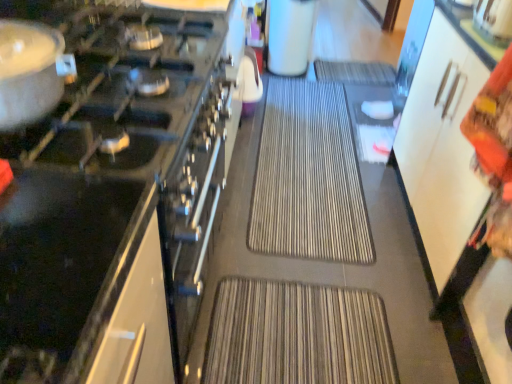
Image resolution: width=512 pixels, height=384 pixels. What do you see at coordinates (289, 35) in the screenshot?
I see `white matte coffee maker at upper center, the second appliance positioned from the left` at bounding box center [289, 35].

The width and height of the screenshot is (512, 384). What are the coordinates of `brown textured mat at center` in the screenshot? It's located at (308, 178).

Find the location of `white matte coffee maker at upper center, the second appliance positioned from the left`. white matte coffee maker at upper center, the second appliance positioned from the left is located at coordinates (289, 35).

Identify the location of the 1st appliance below the white matte coffee maker at upper center, the second appliance positioned from the left (from the image's perspective). The width and height of the screenshot is (512, 384). (494, 21).

Is metallic silver kettle at upper right, which appears as the third appliance when viewed from the left, not within white matte coffee maker at upper center, the third appliance in the front-to-back sequence?

metallic silver kettle at upper right, which appears as the third appliance when viewed from the left, lies outside white matte coffee maker at upper center, the third appliance in the front-to-back sequence,'s area.

From a real-world perspective, is metallic silver kettle at upper right, the second appliance from the back, under white matte coffee maker at upper center, acting as the first appliance starting from the back?

No, from a real-world perspective, metallic silver kettle at upper right, the second appliance from the back, is not under white matte coffee maker at upper center, acting as the first appliance starting from the back.

Is metallic silver kettle at upper right, which appears as the third appliance when viewed from the left, far away from white matte coffee maker at upper center, the third appliance ordered from the bottom?

Indeed, metallic silver kettle at upper right, which appears as the third appliance when viewed from the left, is not near white matte coffee maker at upper center, the third appliance ordered from the bottom.

Can white matte coffee maker at upper center, which appears as the 2th appliance when viewed from the right, be found inside black glass cooktop at left, arranged as the first appliance when ordered from the bottom?

No, white matte coffee maker at upper center, which appears as the 2th appliance when viewed from the right, is not a part of black glass cooktop at left, arranged as the first appliance when ordered from the bottom.

In the scene shown: Considering the relative positions of black glass cooktop at left, marked as the 1th appliance in a front-to-back arrangement, and white matte coffee maker at upper center, which is the first appliance from top to bottom, in the image provided, is black glass cooktop at left, marked as the 1th appliance in a front-to-back arrangement, to the left of white matte coffee maker at upper center, which is the first appliance from top to bottom, from the viewer's perspective?

Yes.

Is black glass cooktop at left, marked as the 1th appliance in a front-to-back arrangement, turned away from white matte coffee maker at upper center, the third appliance ordered from the bottom?

No.

Considering the positions of points (503, 24) and (280, 118), is point (503, 24) closer to camera compared to point (280, 118)?

Yes.

Looking at this image, from the image's perspective, does metallic silver kettle at upper right, which ranks as the 2th appliance in front-to-back order, appear lower than brown textured mat at center?

No.

How many degrees apart are the facing directions of metallic silver kettle at upper right, which appears as the third appliance when viewed from the left, and brown textured mat at center?

The facing directions of metallic silver kettle at upper right, which appears as the third appliance when viewed from the left, and brown textured mat at center are 89.7 degrees apart.

Is metallic silver kettle at upper right, which appears as the third appliance when viewed from the left, bigger than brown textured mat at center?

No.

Which is more distant, [35,25] or [142,27]?

Positioned behind is point [142,27].

Locate an element on the screen. This screenshot has width=512, height=384. appliance below the matte silver pot at left (from the image's perspective) is located at coordinates (118, 198).

From the image's perspective, does matte silver pot at left appear lower than black glass cooktop at left, acting as the 3th appliance starting from the top?

No, from the image's perspective, matte silver pot at left is not beneath black glass cooktop at left, acting as the 3th appliance starting from the top.

From a real-world perspective, which object rests below the other?

black glass cooktop at left, the 1th appliance viewed from the left.

Does white matte coffee maker at upper center, which is the first appliance from top to bottom, have a larger size compared to black glass cooktop at left, the 1th appliance viewed from the left?

Incorrect, white matte coffee maker at upper center, which is the first appliance from top to bottom, is not larger than black glass cooktop at left, the 1th appliance viewed from the left.

Is white matte coffee maker at upper center, which is the first appliance from top to bottom, further to the viewer compared to black glass cooktop at left, acting as the 3th appliance starting from the top?

Yes, white matte coffee maker at upper center, which is the first appliance from top to bottom, is further from the viewer.

Can you tell me how much white matte coffee maker at upper center, the second appliance positioned from the left, and black glass cooktop at left, the 3th appliance in the back-to-front sequence, differ in facing direction?

white matte coffee maker at upper center, the second appliance positioned from the left, and black glass cooktop at left, the 3th appliance in the back-to-front sequence, are facing 89.8 degrees away from each other.

Considering the sizes of objects white matte coffee maker at upper center, which is the first appliance from top to bottom, and black glass cooktop at left, which ranks as the 3th appliance in right-to-left order, in the image provided, who is taller, white matte coffee maker at upper center, which is the first appliance from top to bottom, or black glass cooktop at left, which ranks as the 3th appliance in right-to-left order,?

black glass cooktop at left, which ranks as the 3th appliance in right-to-left order, is taller.

Between matte silver pot at left and brown textured mat at center, which one appears on the right side from the viewer's perspective?

From the viewer's perspective, brown textured mat at center appears more on the right side.

Is matte silver pot at left with brown textured mat at center?

matte silver pot at left and brown textured mat at center are clearly separated.

Is the depth of matte silver pot at left greater than that of brown textured mat at center?

No, matte silver pot at left is closer to the camera.

From a real-world perspective, does matte silver pot at left stand above brown textured mat at center?

Yes, from a real-world perspective, matte silver pot at left is above brown textured mat at center.

From the image's perspective, is white matte coffee maker at upper center, acting as the first appliance starting from the back, over brown textured mat at center?

Correct, white matte coffee maker at upper center, acting as the first appliance starting from the back, appears higher than brown textured mat at center in the image.

Is the position of white matte coffee maker at upper center, which is the first appliance from top to bottom, more distant than that of brown textured mat at center?

Yes, white matte coffee maker at upper center, which is the first appliance from top to bottom, is behind brown textured mat at center.

In the scene shown: Does white matte coffee maker at upper center, which appears as the 2th appliance when viewed from the right, touch brown textured mat at center?

white matte coffee maker at upper center, which appears as the 2th appliance when viewed from the right, and brown textured mat at center are clearly separated.

Can you tell me how much white matte coffee maker at upper center, the third appliance ordered from the bottom, and brown textured mat at center differ in facing direction?

white matte coffee maker at upper center, the third appliance ordered from the bottom, and brown textured mat at center are facing 0.865 degrees away from each other.

Locate an element on the screen. This screenshot has width=512, height=384. the 1st appliance in front when counting from the white matte coffee maker at upper center, which is the first appliance from top to bottom is located at coordinates (494, 21).

The image size is (512, 384). I want to click on appliance that is the 2nd object located behind the black glass cooktop at left, which ranks as the 3th appliance in right-to-left order, so click(289, 35).

Estimate the real-world distances between objects in this image. Which object is closer to black glass cooktop at left, which ranks as the 3th appliance in right-to-left order, brown textured mat at center or white matte coffee maker at upper center, which appears as the 2th appliance when viewed from the right?

Based on the image, brown textured mat at center appears to be nearer to black glass cooktop at left, which ranks as the 3th appliance in right-to-left order.

Estimate the real-world distances between objects in this image. Which object is further from matte silver pot at left, white matte coffee maker at upper center, which appears as the 2th appliance when viewed from the right, or brown textured mat at center?

The object further to matte silver pot at left is white matte coffee maker at upper center, which appears as the 2th appliance when viewed from the right.

From the image, which object appears to be farther from black glass cooktop at left, which ranks as the 3th appliance in right-to-left order, matte silver pot at left or white matte coffee maker at upper center, which appears as the 2th appliance when viewed from the right?

white matte coffee maker at upper center, which appears as the 2th appliance when viewed from the right.

Estimate the real-world distances between objects in this image. Which object is further from brown textured mat at center, black glass cooktop at left, acting as the 3th appliance starting from the top, or metallic silver kettle at upper right, the 2th appliance positioned from the bottom?

metallic silver kettle at upper right, the 2th appliance positioned from the bottom.

Considering their positions, is metallic silver kettle at upper right, which ranks as the 2th appliance in front-to-back order, positioned closer to white matte coffee maker at upper center, which appears as the 2th appliance when viewed from the right, than brown textured mat at center?

Among the two, brown textured mat at center is located nearer to white matte coffee maker at upper center, which appears as the 2th appliance when viewed from the right.

Looking at this image, when comparing their distances from metallic silver kettle at upper right, the 2th appliance positioned from the bottom, does black glass cooktop at left, acting as the 3th appliance starting from the top, or matte silver pot at left seem further?

matte silver pot at left is positioned further to the anchor metallic silver kettle at upper right, the 2th appliance positioned from the bottom.

Estimate the real-world distances between objects in this image. Which object is further from black glass cooktop at left, the 3th appliance in the back-to-front sequence, white matte coffee maker at upper center, the third appliance ordered from the bottom, or metallic silver kettle at upper right, the second appliance from the back?

white matte coffee maker at upper center, the third appliance ordered from the bottom.

Based on the photo, which object lies further to the anchor point matte silver pot at left, white matte coffee maker at upper center, which is the first appliance from top to bottom, or metallic silver kettle at upper right, the first appliance positioned from the right?

white matte coffee maker at upper center, which is the first appliance from top to bottom, is further to matte silver pot at left.

Identify the location of wide between metallic silver kettle at upper right, the first appliance positioned from the right, and white matte coffee maker at upper center, the second appliance positioned from the left, in the front-back direction. (308, 178).

Find the location of `appliance positioned between black glass cooktop at left, arranged as the first appliance when ordered from the bottom, and white matte coffee maker at upper center, the third appliance in the front-to-back sequence, from near to far`. appliance positioned between black glass cooktop at left, arranged as the first appliance when ordered from the bottom, and white matte coffee maker at upper center, the third appliance in the front-to-back sequence, from near to far is located at coordinates (494, 21).

This screenshot has height=384, width=512. Identify the location of wide between black glass cooktop at left, arranged as the first appliance when ordered from the bottom, and metallic silver kettle at upper right, the 2th appliance positioned from the bottom, from left to right. (308, 178).

This screenshot has width=512, height=384. Identify the location of wide between matte silver pot at left and metallic silver kettle at upper right, which appears as the 2th appliance when viewed from the top, from left to right. (308, 178).